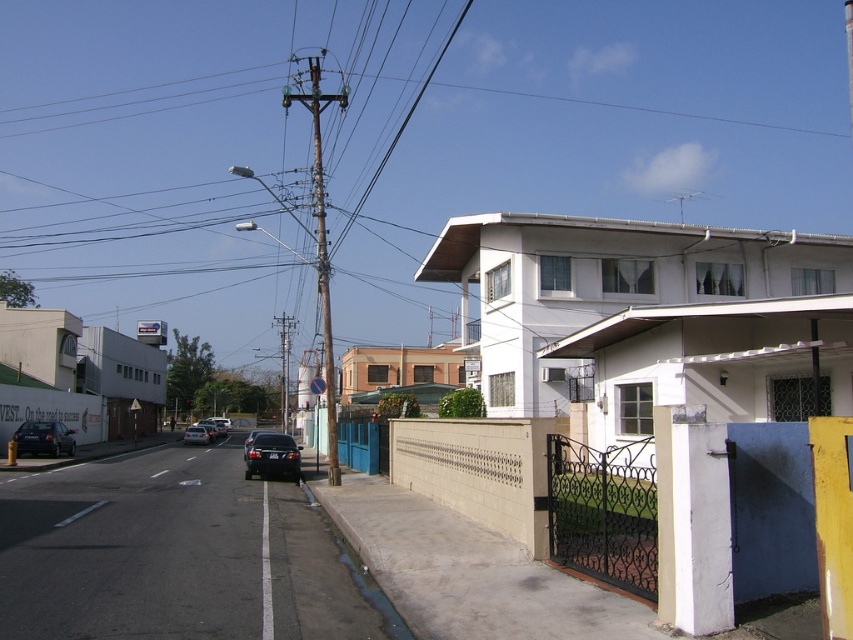
Question: Does metallic utility pole at center lie in front of shiny black sedan at center-left?

Choices:
 (A) no
 (B) yes

Answer: (B)

Question: Which of the following is the closest to the observer?

Choices:
 (A) satin black sedan at lower center
 (B) metallic utility pole at center
 (C) shiny black sedan at left

Answer: (B)

Question: Can you confirm if metallic utility pole at center is positioned to the right of shiny silver sedan at center?

Choices:
 (A) no
 (B) yes

Answer: (B)

Question: Which of the following is the closest to the observer?

Choices:
 (A) (73, 448)
 (B) (196, 435)
 (C) (318, 122)
 (D) (293, 476)

Answer: (D)

Question: Considering the real-world distances, which object is farthest from the metallic utility pole at center?

Choices:
 (A) shiny black sedan at center-left
 (B) shiny silver sedan at center

Answer: (A)

Question: Can you confirm if metallic utility pole at center is thinner than shiny silver sedan at center?

Choices:
 (A) yes
 (B) no

Answer: (B)